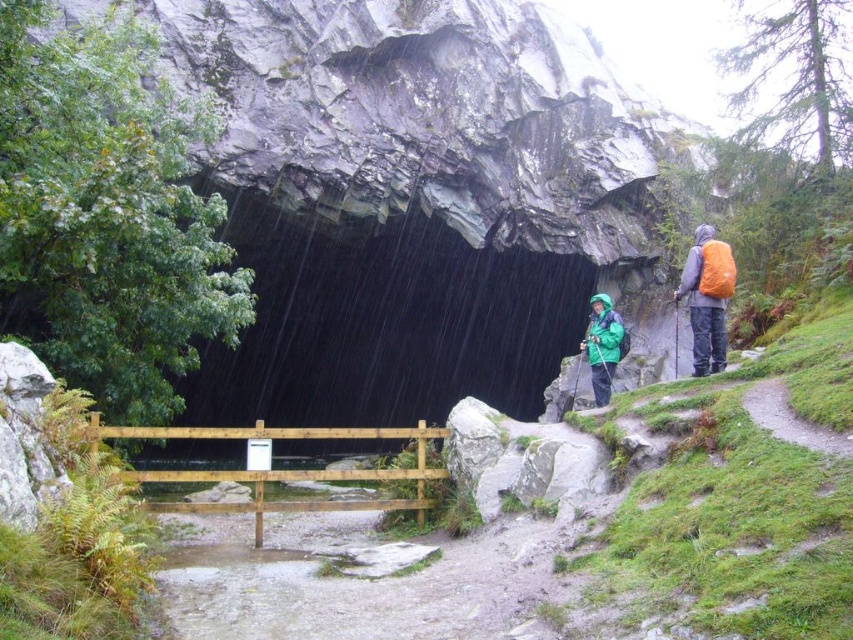
Question: Is dark gray stone cave at center below orange backpack at right?

Choices:
 (A) yes
 (B) no

Answer: (A)

Question: Considering the relative positions of dark gray stone cave at center and green matte jacket at center in the image provided, where is dark gray stone cave at center located with respect to green matte jacket at center?

Choices:
 (A) left
 (B) right

Answer: (A)

Question: Which of the following is the farthest from the observer?

Choices:
 (A) (363, 420)
 (B) (720, 308)
 (C) (624, 332)
 (D) (689, 275)

Answer: (A)

Question: Which point is farther to the camera?

Choices:
 (A) (721, 323)
 (B) (595, 371)
 (C) (410, 268)

Answer: (C)

Question: Is green waterproof jacket at center positioned at the back of orange backpack at right?

Choices:
 (A) no
 (B) yes

Answer: (A)

Question: Which point is farther from the camera taking this photo?

Choices:
 (A) (596, 333)
 (B) (714, 372)
 (C) (694, 289)
 (D) (299, 289)

Answer: (D)